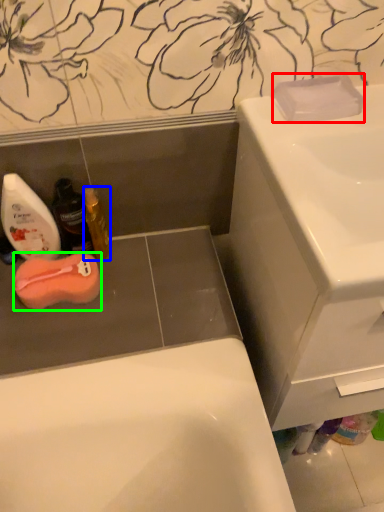
Question: Considering the real-world distances, which object is closest to soap (highlighted by a red box)? mouthwash (highlighted by a blue box) or soap (highlighted by a green box).

Choices:
 (A) mouthwash
 (B) soap

Answer: (A)